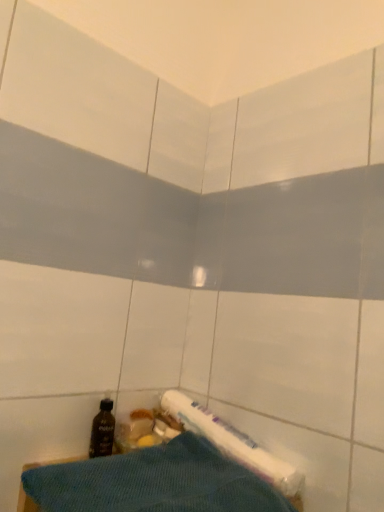
The height and width of the screenshot is (512, 384). Describe the element at coordinates (154, 482) in the screenshot. I see `blue textured towel at lower center` at that location.

You are a GUI agent. You are given a task and a screenshot of the screen. Output one action in this format:
    pyautogui.click(x=<x>, y=<y>)
    Task: Click on the blue textured towel at lower center
    The width and height of the screenshot is (384, 512).
    Given the screenshot: What is the action you would take?
    pyautogui.click(x=154, y=482)

Measure the distance between black plastic bottle at lower left and camera.

black plastic bottle at lower left is 32.64 inches from camera.

The height and width of the screenshot is (512, 384). What are the coordinates of `black plastic bottle at lower left` in the screenshot? It's located at (102, 431).

What do you see at coordinates (102, 431) in the screenshot?
I see `black plastic bottle at lower left` at bounding box center [102, 431].

What is the approximate width of black plastic bottle at lower left?

black plastic bottle at lower left is 1.99 inches in width.

The width and height of the screenshot is (384, 512). I want to click on blue textured towel at lower center, so click(154, 482).

Looking at this image, does blue textured towel at lower center appear on the right side of black plastic bottle at lower left?

Yes, blue textured towel at lower center is to the right of black plastic bottle at lower left.

Based on the photo, which object is closer to the camera, blue textured towel at lower center or black plastic bottle at lower left?

blue textured towel at lower center.

Is point (207, 502) positioned before point (100, 416)?

That is True.

From the image's perspective, which one is positioned lower, blue textured towel at lower center or black plastic bottle at lower left?

blue textured towel at lower center is shown below in the image.

From a real-world perspective, is blue textured towel at lower center over black plastic bottle at lower left?

Incorrect, from a real-world perspective, blue textured towel at lower center is lower than black plastic bottle at lower left.

Looking at this image, which object is wider, blue textured towel at lower center or black plastic bottle at lower left?

blue textured towel at lower center.

Is blue textured towel at lower center taller than black plastic bottle at lower left?

Indeed, blue textured towel at lower center has a greater height compared to black plastic bottle at lower left.

Can you confirm if blue textured towel at lower center is smaller than black plastic bottle at lower left?

Actually, blue textured towel at lower center might be larger than black plastic bottle at lower left.

Does blue textured towel at lower center contain black plastic bottle at lower left?

No, black plastic bottle at lower left is not a part of blue textured towel at lower center.

Can you see blue textured towel at lower center touching black plastic bottle at lower left?

No, blue textured towel at lower center is not making contact with black plastic bottle at lower left.

Could you tell me if blue textured towel at lower center is turned towards black plastic bottle at lower left?

No, blue textured towel at lower center is not turned towards black plastic bottle at lower left.

Where is `bottle above the blue textured towel at lower center (from the image's perspective)`? bottle above the blue textured towel at lower center (from the image's perspective) is located at coordinates (102, 431).

Based on the photo, is black plastic bottle at lower left to the left of blue textured towel at lower center from the viewer's perspective?

Yes, black plastic bottle at lower left is to the left of blue textured towel at lower center.

In the scene shown: Is black plastic bottle at lower left positioned in front of blue textured towel at lower center?

No, black plastic bottle at lower left is further to the viewer.

Is point (105, 444) positioned behind point (56, 468)?

Yes.

From the image's perspective, would you say black plastic bottle at lower left is positioned over blue textured towel at lower center?

Yes.

From a real-world perspective, is black plastic bottle at lower left under blue textured towel at lower center?

Actually, black plastic bottle at lower left is physically above blue textured towel at lower center in the real world.

Can you confirm if black plastic bottle at lower left is wider than blue textured towel at lower center?

In fact, black plastic bottle at lower left might be narrower than blue textured towel at lower center.

Does black plastic bottle at lower left have a greater height compared to blue textured towel at lower center?

Incorrect, the height of black plastic bottle at lower left is not larger of that of blue textured towel at lower center.

Considering the relative sizes of black plastic bottle at lower left and blue textured towel at lower center in the image provided, is black plastic bottle at lower left smaller than blue textured towel at lower center?

Yes.

Is blue textured towel at lower center a part of black plastic bottle at lower left?

No.

Is black plastic bottle at lower left not close to blue textured towel at lower center?

That's not correct — black plastic bottle at lower left is a little close to blue textured towel at lower center.

Is black plastic bottle at lower left facing away from blue textured towel at lower center?

No, black plastic bottle at lower left's orientation is not away from blue textured towel at lower center.

How many degrees apart are the facing directions of black plastic bottle at lower left and blue textured towel at lower center?

The angle between the facing direction of black plastic bottle at lower left and the facing direction of blue textured towel at lower center is 2.41 degrees.

Measure the distance from black plastic bottle at lower left to blue textured towel at lower center.

A distance of 18.98 centimeters exists between black plastic bottle at lower left and blue textured towel at lower center.

Image resolution: width=384 pixels, height=512 pixels. Find the location of `sheet in front of the black plastic bottle at lower left`. sheet in front of the black plastic bottle at lower left is located at coordinates (154, 482).

What are the coordinates of `sheet in front of the black plastic bottle at lower left` in the screenshot? It's located at (154, 482).

Identify the location of sheet that appears below the black plastic bottle at lower left (from a real-world perspective). This screenshot has width=384, height=512. (154, 482).